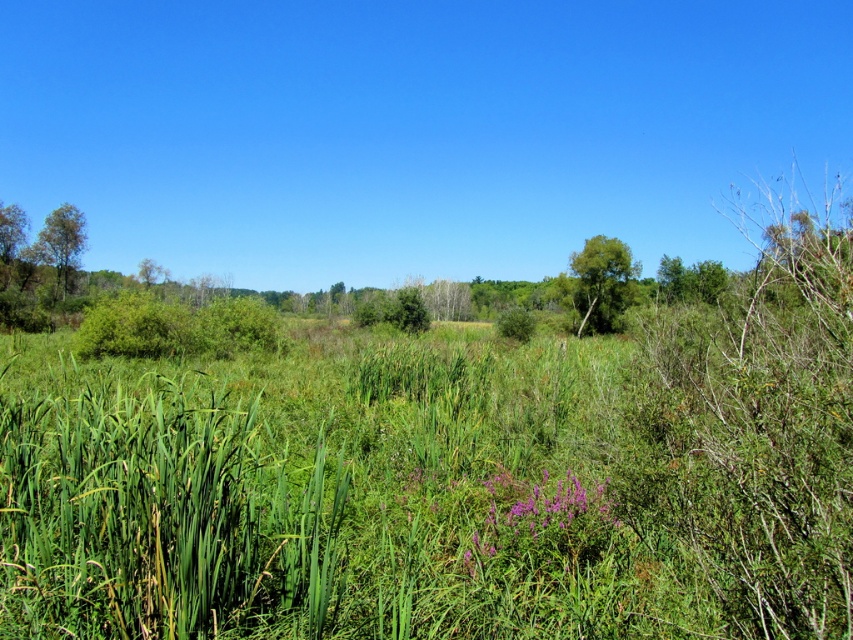
Question: Is green matte tree at left bigger than green leafy tree at upper left?

Choices:
 (A) no
 (B) yes

Answer: (B)

Question: Which point is closer to the camera?

Choices:
 (A) (161, 268)
 (B) (59, 225)

Answer: (B)

Question: Is green leafy tree at center smaller than green leafy tree at upper left?

Choices:
 (A) no
 (B) yes

Answer: (A)

Question: Is green matte tree at left closer to camera compared to green leafy tree at upper left?

Choices:
 (A) yes
 (B) no

Answer: (A)

Question: Estimate the real-world distances between objects in this image. Which object is farther from the green matte tree at left?

Choices:
 (A) green leafy tree at upper left
 (B) green leafy tree at center

Answer: (B)

Question: Which of these objects is positioned farthest from the green leafy tree at upper left?

Choices:
 (A) green leafy tree at center
 (B) green matte tree at left

Answer: (A)